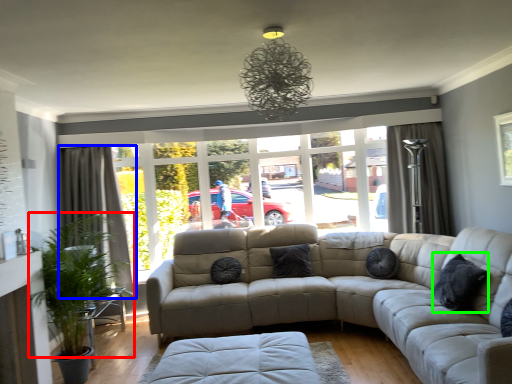
Question: Which is nearer to the plant (highlighted by a red box)? curtain (highlighted by a blue box) or pillow (highlighted by a green box).

Choices:
 (A) curtain
 (B) pillow

Answer: (A)